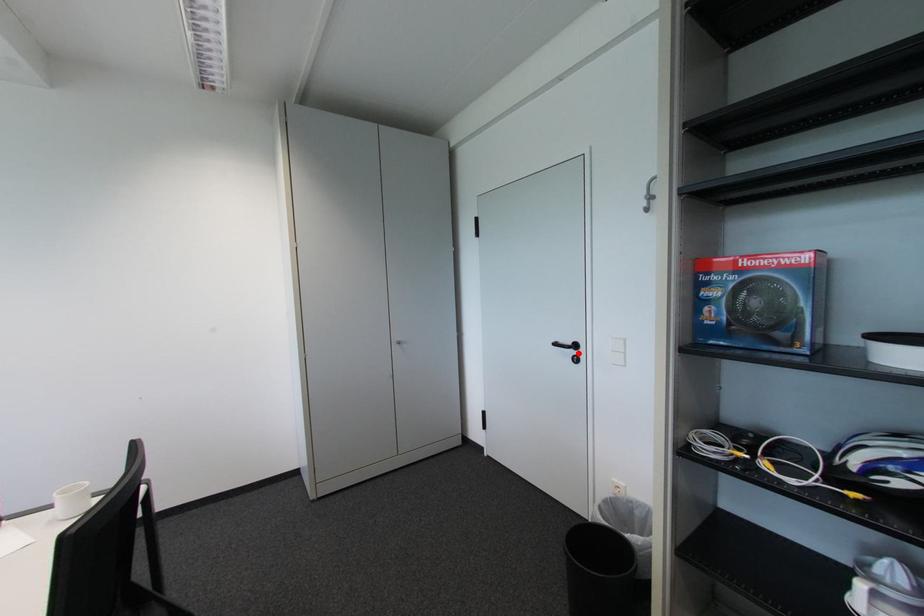
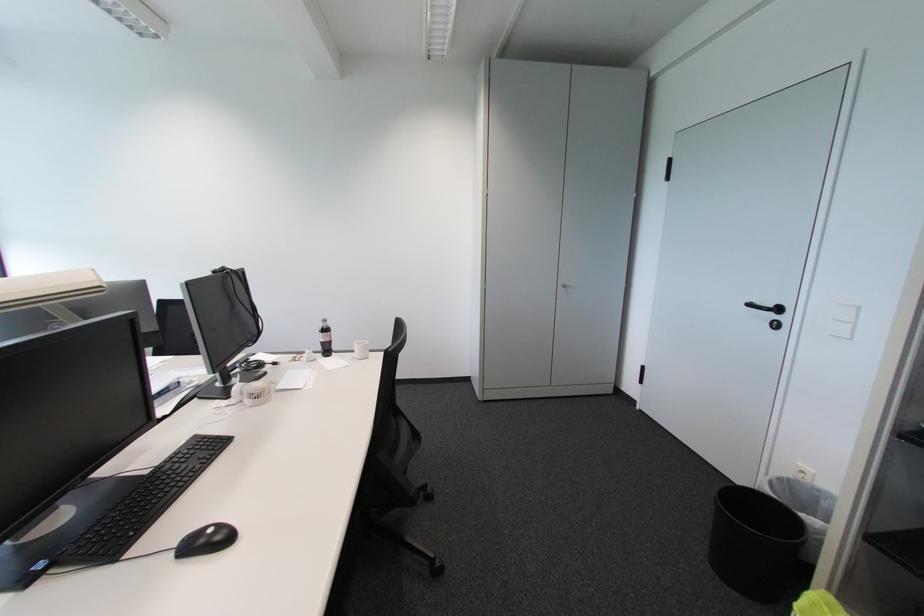
The point at the highlighted location is marked in the first image. Where is the corresponding point in the second image?

(777, 317)